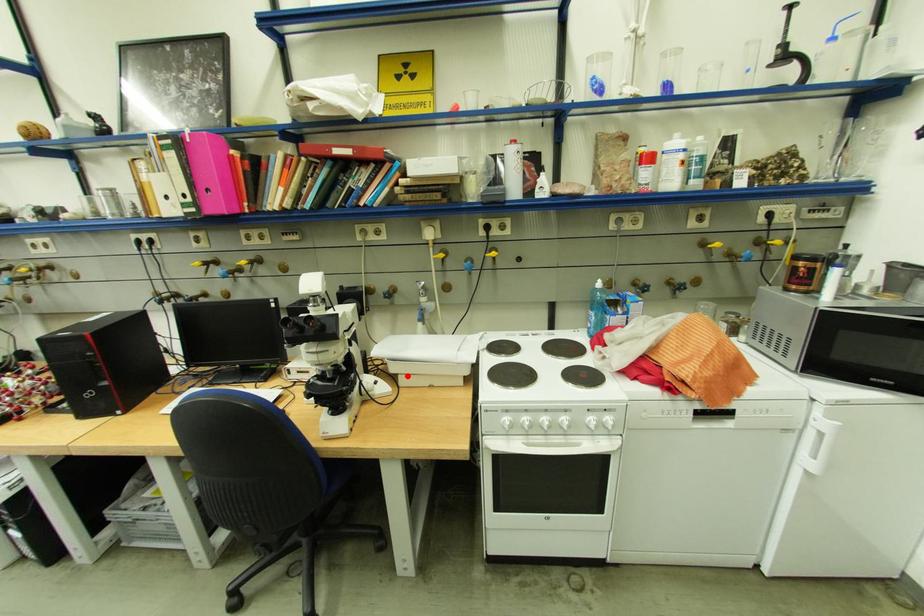
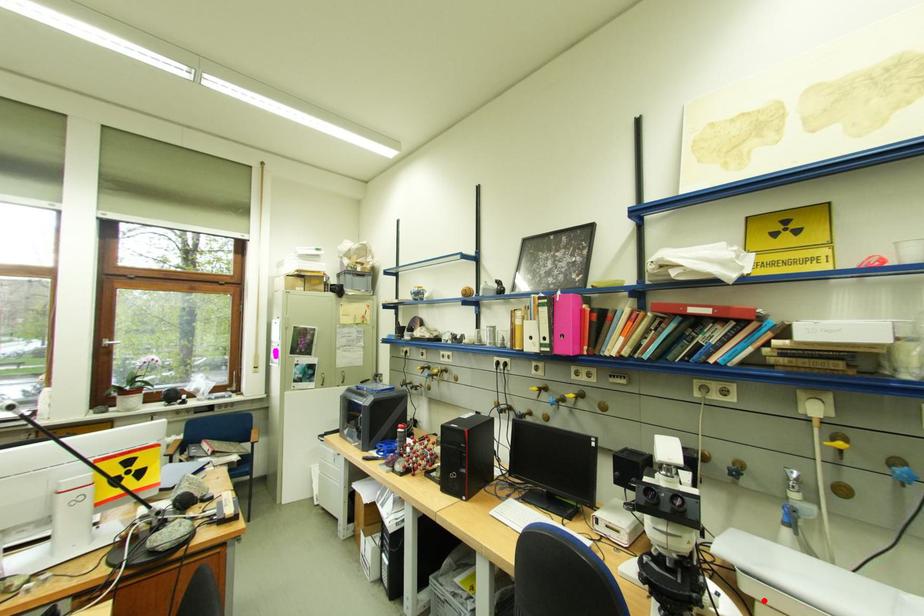
I am providing you with two images of the same scene from different viewpoints. A red point is marked on the first image and another point is marked on the second image. Are the points marked in image1 and image2 representing the same 3D position?

Yes